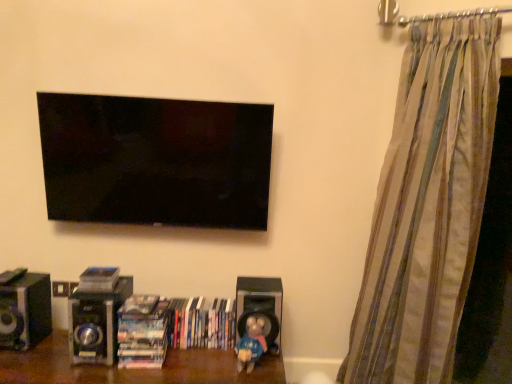
At what (x,y) coordinates should I click in order to perform the action: click on vacant area that is in front of hardcover books at center, which is the first book from right to left. Please return your answer as a coordinate pair (x, y). The height and width of the screenshot is (384, 512). Looking at the image, I should click on (195, 355).